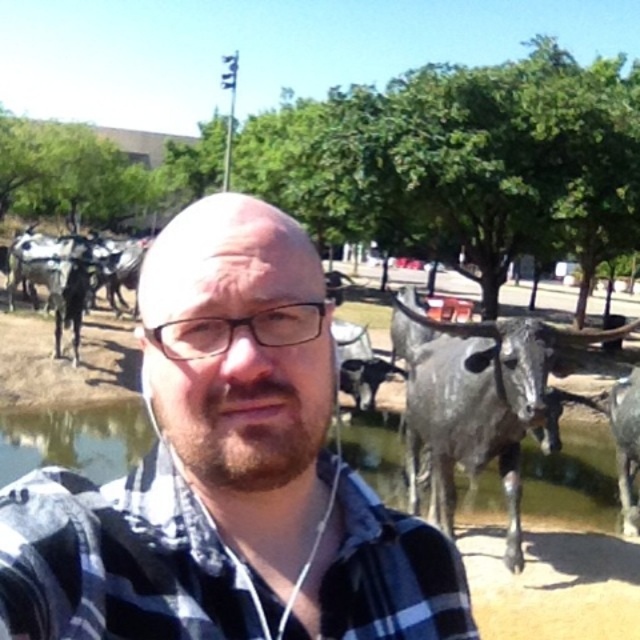
Question: Which object is the farthest from the blue plaid shirt at center?

Choices:
 (A) clear water at center
 (B) gray metallic bull at right

Answer: (A)

Question: Can you confirm if blue plaid shirt at center is positioned below gray metallic bull at right?

Choices:
 (A) no
 (B) yes

Answer: (A)

Question: Which object is farther from the camera taking this photo?

Choices:
 (A) gray metallic bull at right
 (B) blue plaid shirt at center

Answer: (A)

Question: Can you confirm if blue plaid shirt at center is thinner than clear water at center?

Choices:
 (A) no
 (B) yes

Answer: (B)

Question: Which point appears farthest from the camera in this image?

Choices:
 (A) (488, 378)
 (B) (16, 476)
 (C) (276, 564)

Answer: (B)

Question: Can you confirm if clear water at center is bigger than gray metallic bull at right?

Choices:
 (A) yes
 (B) no

Answer: (A)